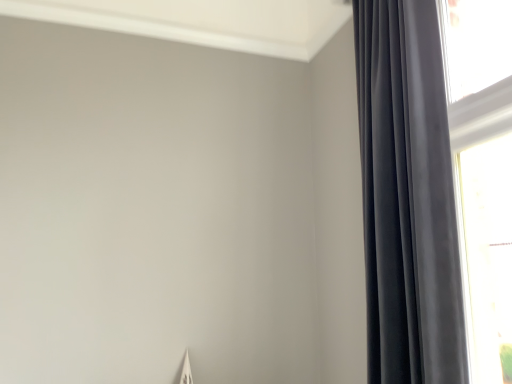
Question: Is transparent glass window at right beside satin black curtain at right?

Choices:
 (A) yes
 (B) no

Answer: (B)

Question: Considering the relative positions of transparent glass window at right and satin black curtain at right in the image provided, is transparent glass window at right behind satin black curtain at right?

Choices:
 (A) yes
 (B) no

Answer: (A)

Question: Is transparent glass window at right outside of satin black curtain at right?

Choices:
 (A) no
 (B) yes

Answer: (B)

Question: Can you confirm if transparent glass window at right is bigger than satin black curtain at right?

Choices:
 (A) no
 (B) yes

Answer: (A)

Question: Considering the relative positions of transparent glass window at right and satin black curtain at right in the image provided, is transparent glass window at right to the right of satin black curtain at right from the viewer's perspective?

Choices:
 (A) no
 (B) yes

Answer: (B)

Question: Considering the relative sizes of transparent glass window at right and satin black curtain at right in the image provided, is transparent glass window at right smaller than satin black curtain at right?

Choices:
 (A) no
 (B) yes

Answer: (B)

Question: Would you say satin black curtain at right contains transparent glass window at right?

Choices:
 (A) no
 (B) yes

Answer: (A)

Question: Considering the relative sizes of satin black curtain at right and transparent glass window at right in the image provided, is satin black curtain at right smaller than transparent glass window at right?

Choices:
 (A) no
 (B) yes

Answer: (A)

Question: Is satin black curtain at right to the right of transparent glass window at right from the viewer's perspective?

Choices:
 (A) no
 (B) yes

Answer: (A)

Question: Is transparent glass window at right at the back of satin black curtain at right?

Choices:
 (A) yes
 (B) no

Answer: (A)

Question: Is satin black curtain at right wider than transparent glass window at right?

Choices:
 (A) yes
 (B) no

Answer: (A)

Question: Is satin black curtain at right not within transparent glass window at right?

Choices:
 (A) no
 (B) yes

Answer: (B)

Question: Visually, is satin black curtain at right positioned to the left or to the right of transparent glass window at right?

Choices:
 (A) left
 (B) right

Answer: (A)